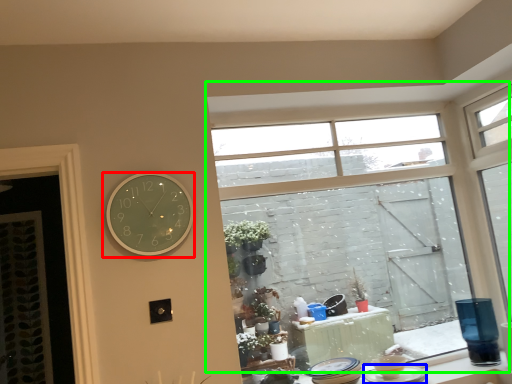
Question: Based on their relative distances, which object is nearer to wall clock (highlighted by a red box)? Choose from tableware (highlighted by a blue box) and window (highlighted by a green box).

Choices:
 (A) tableware
 (B) window

Answer: (A)